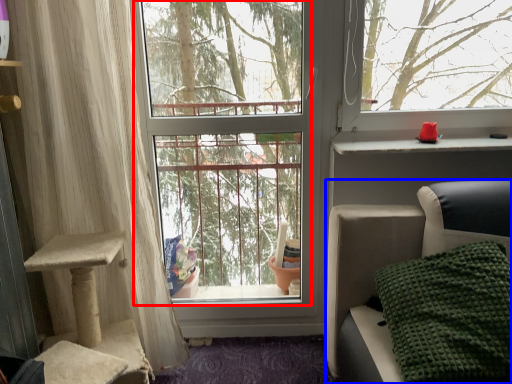
Question: Which object appears closest to the camera in this image, window screen (highlighted by a red box) or furniture (highlighted by a blue box)?

Choices:
 (A) window screen
 (B) furniture

Answer: (B)